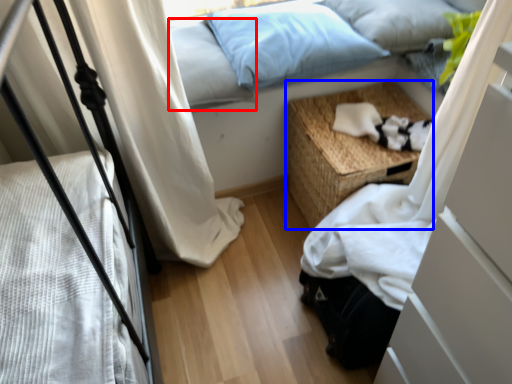
Question: Which point is closer to the camera, pillow (highlighted by a red box) or nightstand (highlighted by a blue box)?

Choices:
 (A) pillow
 (B) nightstand

Answer: (A)